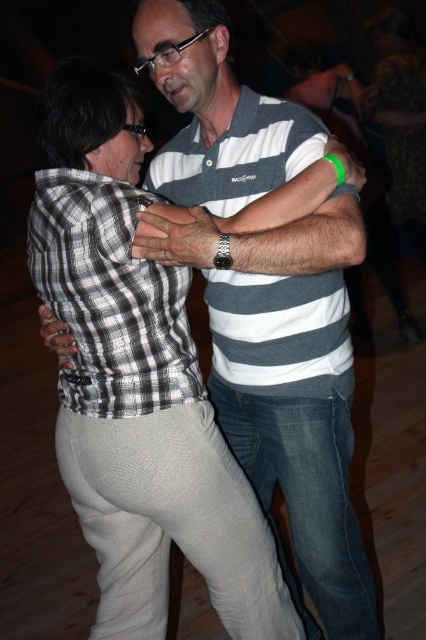
Question: Which of the following is the closest to the observer?

Choices:
 (A) checkered fabric shirt at center
 (B) gray striped polo shirt at center

Answer: (B)

Question: Is gray striped polo shirt at center thinner than checkered fabric shirt at center?

Choices:
 (A) yes
 (B) no

Answer: (B)

Question: Which of the following is the closest to the observer?

Choices:
 (A) (247, 189)
 (B) (74, 374)

Answer: (B)

Question: Considering the relative positions of gray striped polo shirt at center and checkered fabric shirt at center in the image provided, where is gray striped polo shirt at center located with respect to checkered fabric shirt at center?

Choices:
 (A) above
 (B) below

Answer: (A)

Question: Is gray striped polo shirt at center below checkered fabric shirt at center?

Choices:
 (A) yes
 (B) no

Answer: (B)

Question: Among these points, which one is farthest from the camera?

Choices:
 (A) [118, 324]
 (B) [256, 368]

Answer: (B)